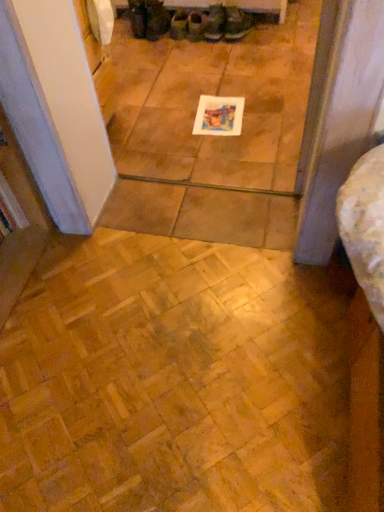
You are a GUI agent. You are given a task and a screenshot of the screen. Output one action in this format:
    pyautogui.click(x=<x>, y=<y>)
    Task: Click on the vacant space in front of leather boot at center, the second footwear viewed from the right
    The height and width of the screenshot is (512, 384).
    Given the screenshot: What is the action you would take?
    pyautogui.click(x=214, y=49)